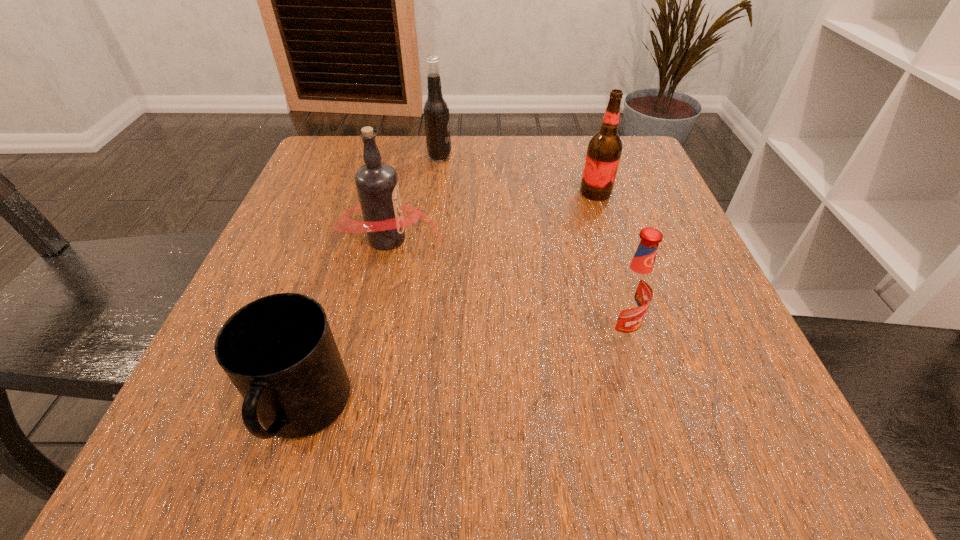
What are the coordinates of `object that is at the near edge` in the screenshot? It's located at (279, 352).

The image size is (960, 540). Find the location of `root beer at the left edge`. root beer at the left edge is located at coordinates (377, 186).

The height and width of the screenshot is (540, 960). Identify the location of mug present at the left edge. (279, 352).

At what (x,y) coordinates should I click in order to perform the action: click on object that is at the near left corner. Please return your answer as a coordinate pair (x, y). Looking at the image, I should click on (279, 352).

Where is `object at the far right corner`? object at the far right corner is located at coordinates (604, 150).

Locate an element on the screen. The width and height of the screenshot is (960, 540). blank space at the far edge is located at coordinates (570, 193).

Where is `vacant area at the near edge of the desktop`? Image resolution: width=960 pixels, height=540 pixels. vacant area at the near edge of the desktop is located at coordinates (428, 433).

Where is `free spot at the left edge of the desktop`? The image size is (960, 540). free spot at the left edge of the desktop is located at coordinates (287, 285).

Image resolution: width=960 pixels, height=540 pixels. Find the location of `vacant area at the right edge`. vacant area at the right edge is located at coordinates (693, 345).

At what (x,y) coordinates should I click in order to perform the action: click on vacant space at the far left corner. Please return your answer as a coordinate pair (x, y). Looking at the image, I should click on (380, 136).